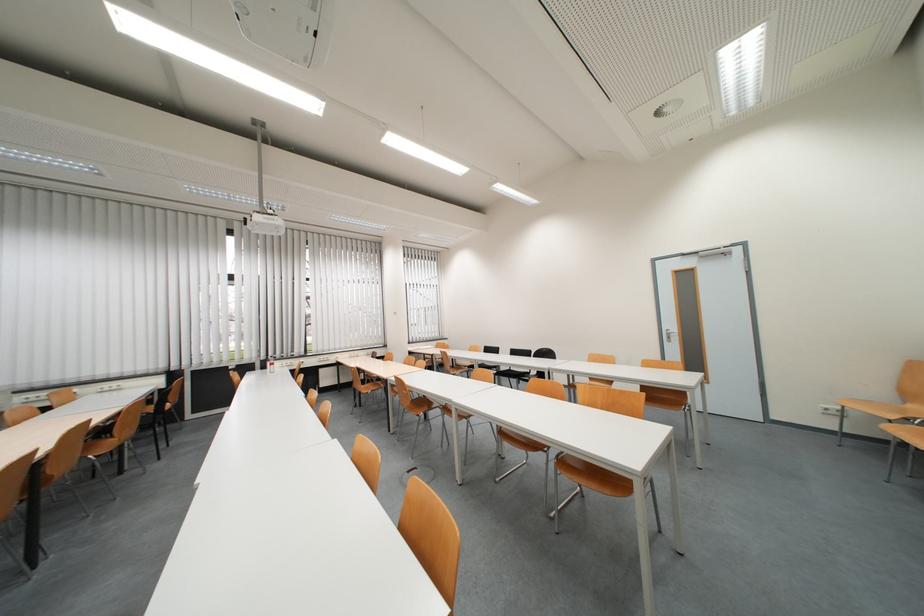
What do you see at coordinates (830, 410) in the screenshot? I see `a white power outlet` at bounding box center [830, 410].